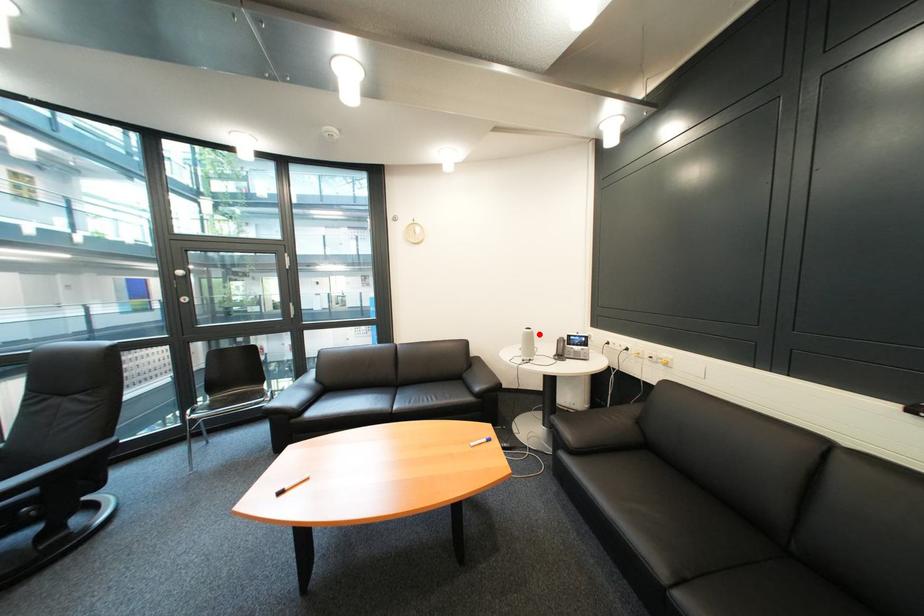
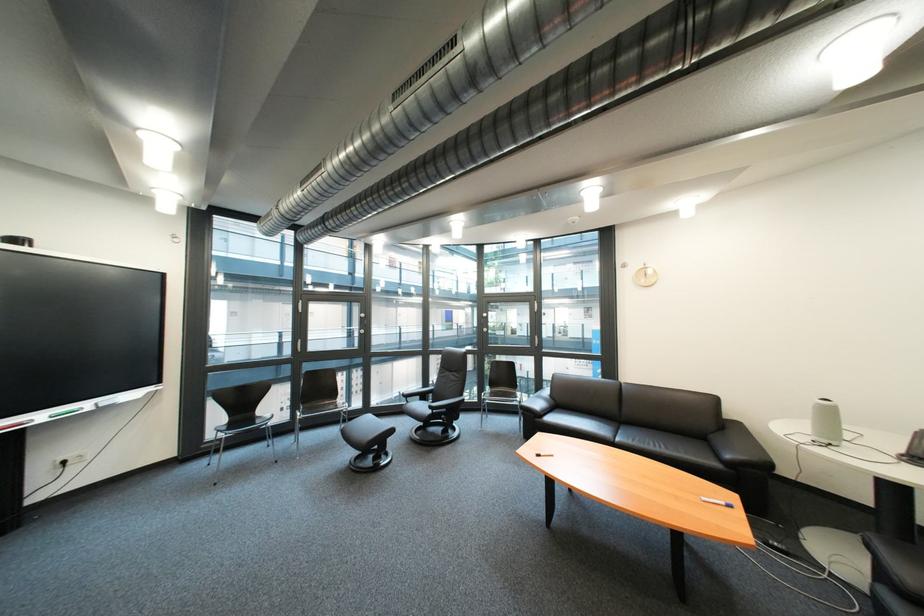
The point at the highlighted location is marked in the first image. Where is the corresponding point in the second image?

(833, 406)